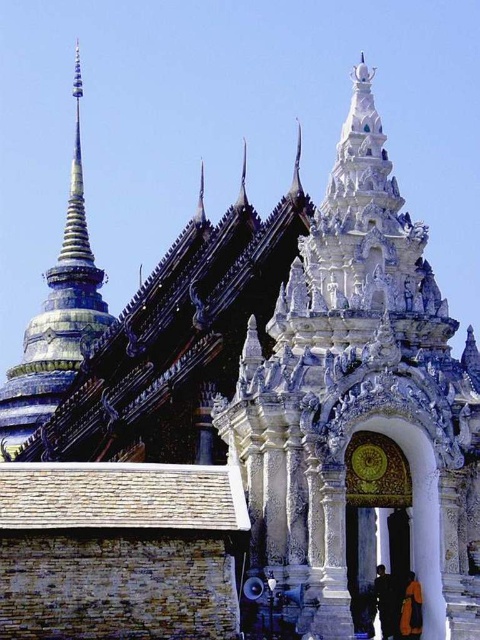
Which is above, orange cloth at lower right or dark blue fabric at lower center?

orange cloth at lower right

Does orange cloth at lower right have a greater width compared to dark blue fabric at lower center?

Yes, orange cloth at lower right is wider than dark blue fabric at lower center.

Which is in front, point (408, 634) or point (386, 609)?

Point (408, 634) is in front.

The width and height of the screenshot is (480, 640). Find the location of `orange cloth at lower right`. orange cloth at lower right is located at coordinates (410, 609).

Looking at this image, is blue lacquered spire at upper left behind orange cloth at lower right?

Yes.

I want to click on blue lacquered spire at upper left, so click(x=57, y=317).

This screenshot has height=640, width=480. I want to click on blue lacquered spire at upper left, so click(57, 317).

Find the location of a particular element. The image size is (480, 640). blue lacquered spire at upper left is located at coordinates (57, 317).

Does blue lacquered spire at upper left appear over dark blue fabric at lower center?

Indeed, blue lacquered spire at upper left is positioned over dark blue fabric at lower center.

Does point (70, 241) lie in front of point (384, 636)?

No, (70, 241) is behind (384, 636).

You are a GUI agent. You are given a task and a screenshot of the screen. Output one action in this format:
    pyautogui.click(x=<x>, y=<y>)
    Task: Click on the blue lacquered spire at upper left
    The image size is (480, 640).
    Given the screenshot: What is the action you would take?
    57,317